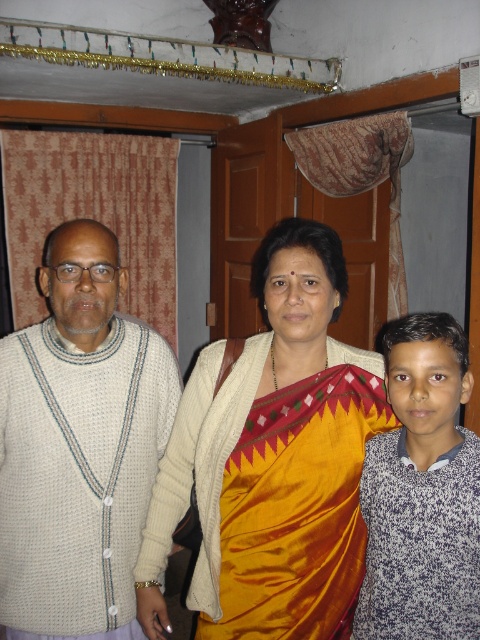
Question: Can you confirm if white knitted sweater at left is bigger than white speckled sweater at right?

Choices:
 (A) yes
 (B) no

Answer: (A)

Question: From the image, what is the correct spatial relationship of white knitted sweater at left in relation to white speckled sweater at right?

Choices:
 (A) above
 (B) below

Answer: (A)

Question: Estimate the real-world distances between objects in this image. Which object is closer to the silk sari at center?

Choices:
 (A) white speckled sweater at right
 (B) white knitted sweater at left

Answer: (A)

Question: Which of the following is the closest to the observer?

Choices:
 (A) white speckled sweater at right
 (B) silk sari at center
 (C) white knitted sweater at left

Answer: (A)

Question: Which point appears closest to the camera in this image?

Choices:
 (A) (398, 476)
 (B) (254, 397)
 (C) (123, 604)

Answer: (A)

Question: Does white knitted sweater at left have a larger size compared to white speckled sweater at right?

Choices:
 (A) yes
 (B) no

Answer: (A)